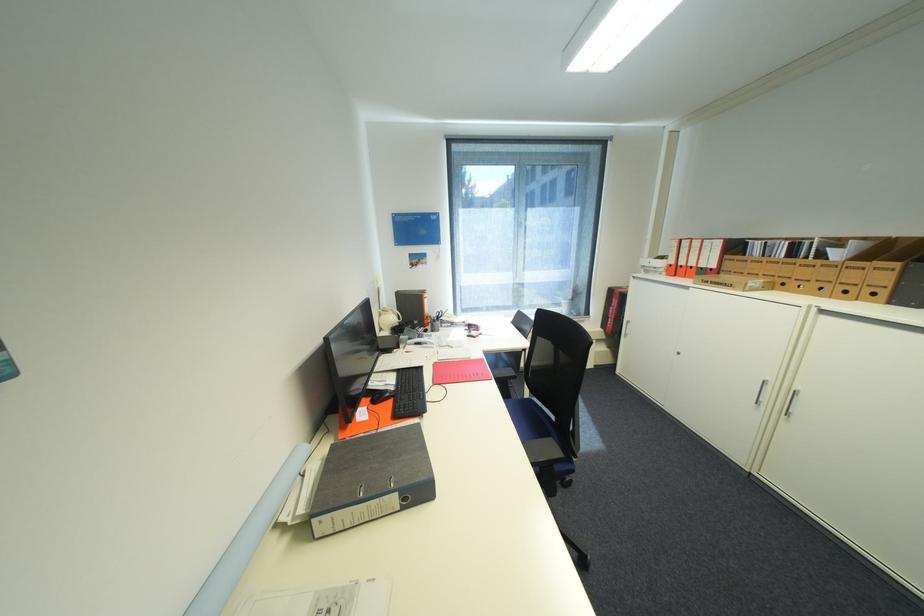
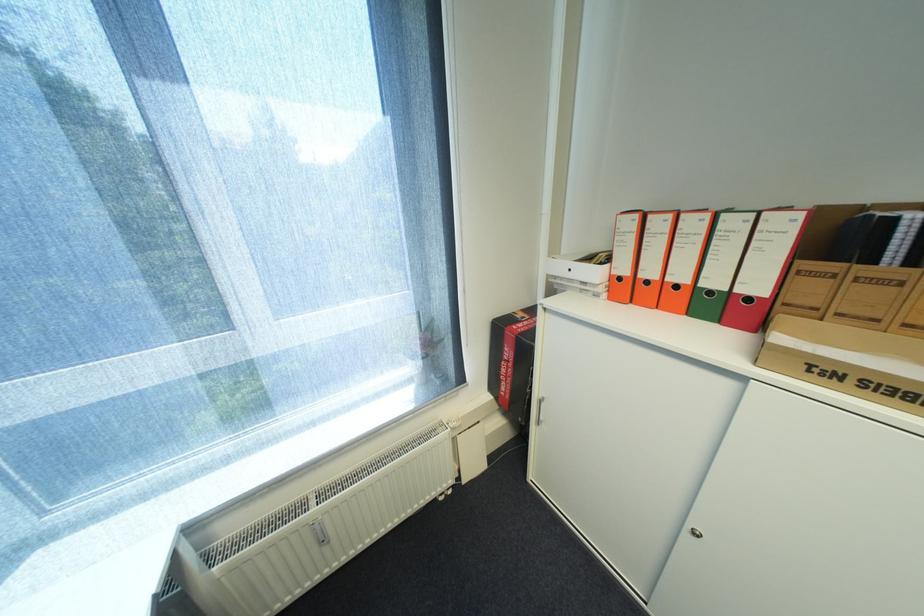
In a continuous first-person perspective shot, in which direction is the camera moving?

The movement direction of the cameraman is right, forward.